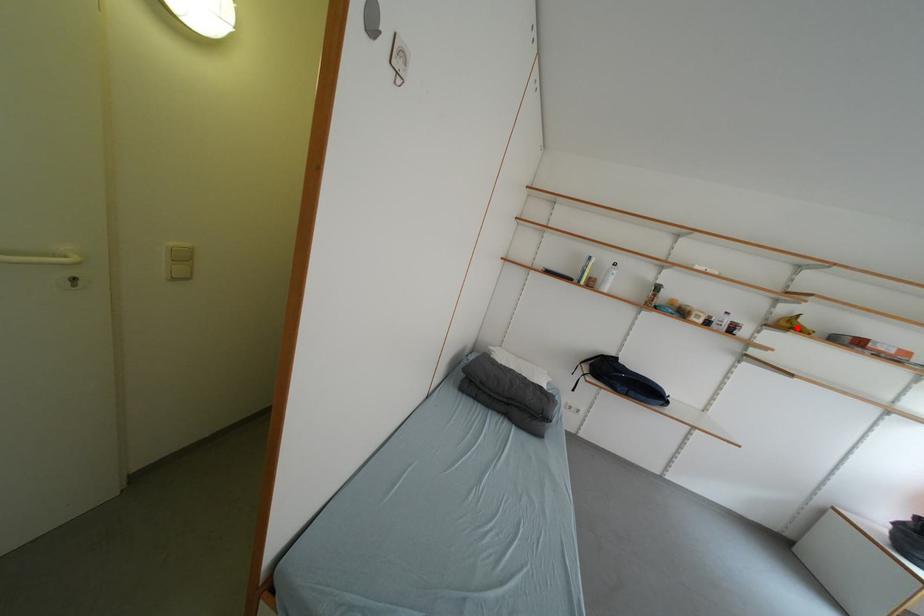
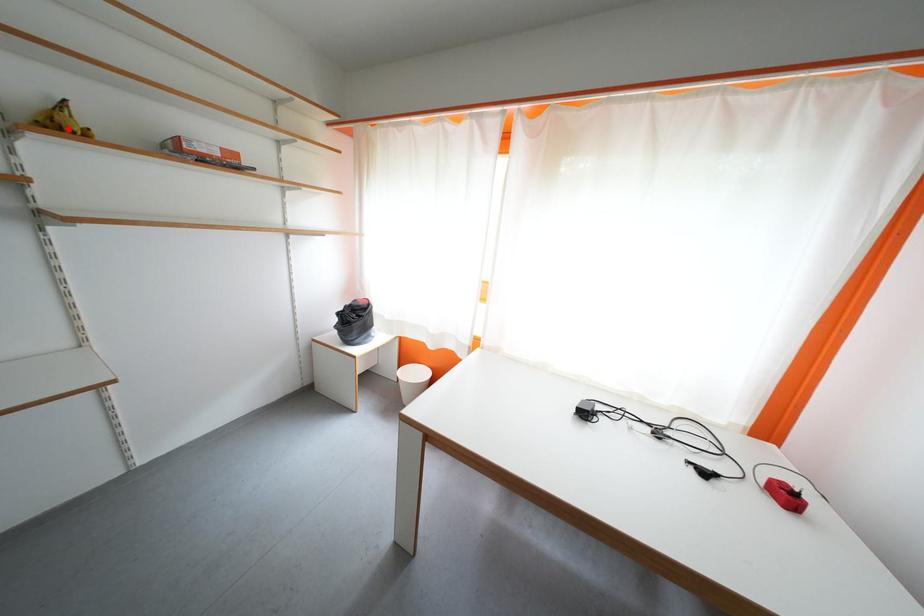
I am providing you with two images of the same scene from different viewpoints. A red point is marked on the first image and another point is marked on the second image. Is the marked point in image1 the same physical position as the marked point in image2?

Yes